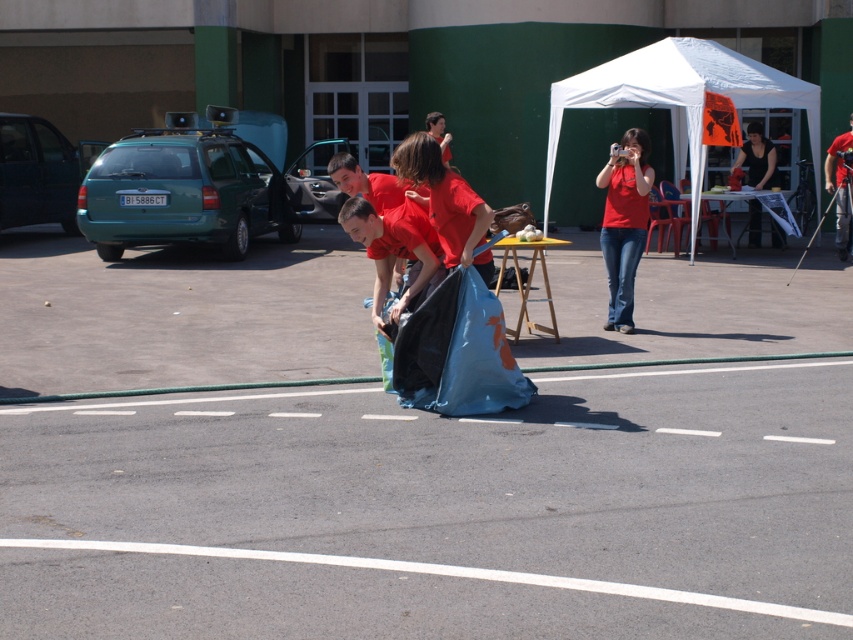
You are a participant in the sack race wearing the matte red shirt at center. Looking up, you notice the white fabric tent at upper right. Can you see the tent from your current position without moving your head?

Yes, the white fabric tent at upper right is above the matte red shirt at center, so you can see it without moving your head.

You are standing at the starting line of the sack race and want to reach the green car parked in the background. You notice two points marked on the ground at coordinates point (602, 99) and point (770, 163). Which point should you step on first to get closer to the green car?

You should step on point (602, 99) first because it is closer to the camera, meaning it is nearer to your starting position, so stepping on it first will bring you closer to the green car.